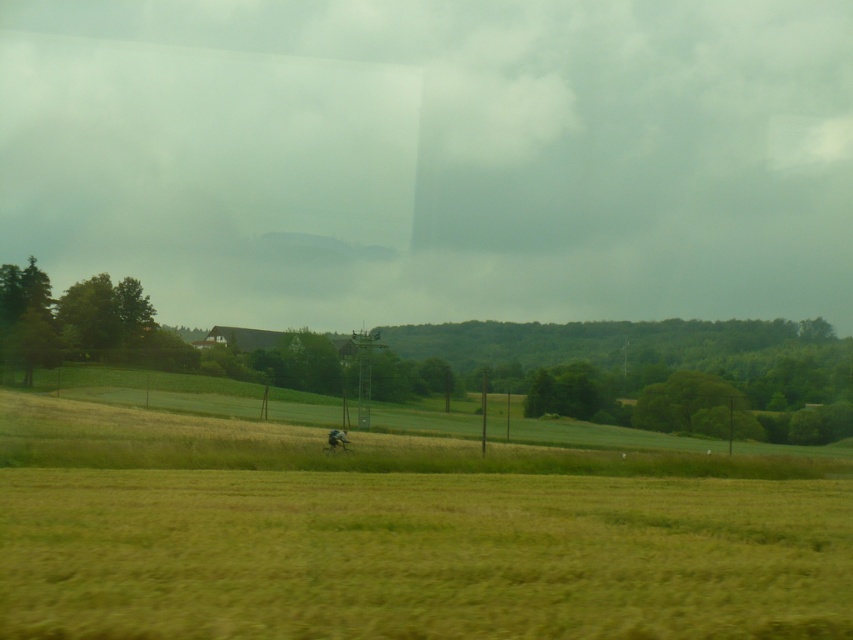
Question: Which of the following is the farthest from the observer?

Choices:
 (A) (199, 435)
 (B) (331, 438)

Answer: (A)

Question: Among these objects, which one is nearest to the camera?

Choices:
 (A) green grassy field at center
 (B) brown fur dog at center

Answer: (A)

Question: Is green grassy field at center to the right of brown fur dog at center from the viewer's perspective?

Choices:
 (A) yes
 (B) no

Answer: (A)

Question: Does green grassy field at center have a lesser width compared to brown fur dog at center?

Choices:
 (A) yes
 (B) no

Answer: (B)

Question: Can you confirm if green grassy field at center is bigger than brown fur dog at center?

Choices:
 (A) no
 (B) yes

Answer: (B)